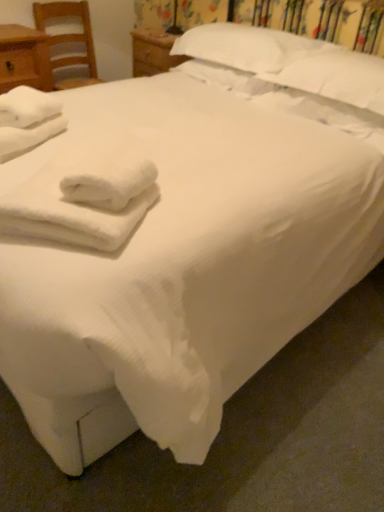
Question: Can you confirm if matte wood nightstand at left is thinner than white soft towel at left, the 1th bath towel when ordered from top to bottom?

Choices:
 (A) no
 (B) yes

Answer: (A)

Question: Is matte wood nightstand at left at the right side of white soft towel at left, arranged as the 1th bath towel when viewed from the back?

Choices:
 (A) yes
 (B) no

Answer: (B)

Question: Considering the relative sizes of matte wood nightstand at left and white soft towel at left, which is counted as the 2th bath towel, starting from the bottom, in the image provided, is matte wood nightstand at left wider than white soft towel at left, which is counted as the 2th bath towel, starting from the bottom,?

Choices:
 (A) yes
 (B) no

Answer: (A)

Question: Can you confirm if matte wood nightstand at left is positioned to the left of white soft towel at left, which ranks as the first bath towel in left-to-right order?

Choices:
 (A) no
 (B) yes

Answer: (B)

Question: Does matte wood nightstand at left touch white soft towel at left, which ranks as the first bath towel in left-to-right order?

Choices:
 (A) no
 (B) yes

Answer: (A)

Question: Considering the positions of white soft pillow at upper center, the first pillow positioned from the left, and wooden chair at left in the image, is white soft pillow at upper center, the first pillow positioned from the left, taller or shorter than wooden chair at left?

Choices:
 (A) tall
 (B) short

Answer: (B)

Question: Considering the relative positions of white soft pillow at upper center, the first pillow positioned from the left, and wooden chair at left in the image provided, is white soft pillow at upper center, the first pillow positioned from the left, to the left or to the right of wooden chair at left?

Choices:
 (A) right
 (B) left

Answer: (A)

Question: In the image, is white soft pillow at upper center, the first pillow positioned from the left, positioned in front of or behind wooden chair at left?

Choices:
 (A) front
 (B) behind

Answer: (A)

Question: Do you think white soft pillow at upper center, the first pillow positioned from the left, is within wooden chair at left, or outside of it?

Choices:
 (A) outside
 (B) inside

Answer: (A)

Question: Is point (251, 42) positioned closer to the camera than point (79, 244)?

Choices:
 (A) farther
 (B) closer

Answer: (A)

Question: In terms of width, does white soft pillow at upper center, the first pillow positioned from the left, look wider or thinner when compared to white fluffy towels at lower left, which is the 1th bath towel in front-to-back order?

Choices:
 (A) wide
 (B) thin

Answer: (A)

Question: From the image's perspective, is white soft pillow at upper center, the first pillow positioned from the left, located above or below white fluffy towels at lower left, which is the second bath towel in left-to-right order?

Choices:
 (A) above
 (B) below

Answer: (A)

Question: In the image, is white soft pillow at upper center, the 2th pillow positioned from the right, positioned in front of or behind white fluffy towels at lower left, which is the second bath towel in left-to-right order?

Choices:
 (A) front
 (B) behind

Answer: (B)

Question: Looking at their shapes, would you say white fluffy towels at lower left, placed as the second bath towel when sorted from top to bottom, is wider or thinner than white soft towel at left, which ranks as the first bath towel in left-to-right order?

Choices:
 (A) wide
 (B) thin

Answer: (A)

Question: From their relative heights in the image, would you say white fluffy towels at lower left, placed as the second bath towel when sorted from top to bottom, is taller or shorter than white soft towel at left, arranged as the 1th bath towel when viewed from the back?

Choices:
 (A) tall
 (B) short

Answer: (A)